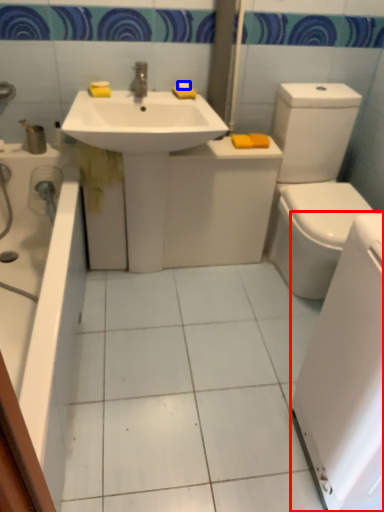
Question: Which object appears farthest to the camera in this image, appliance (highlighted by a red box) or soap (highlighted by a blue box)?

Choices:
 (A) appliance
 (B) soap

Answer: (B)